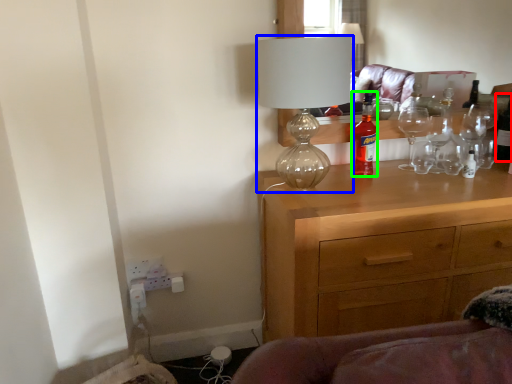
Question: Which object is the closest to the bottle (highlighted by a red box)? Choose among these: lamp (highlighted by a blue box) or bottle (highlighted by a green box).

Choices:
 (A) lamp
 (B) bottle

Answer: (B)